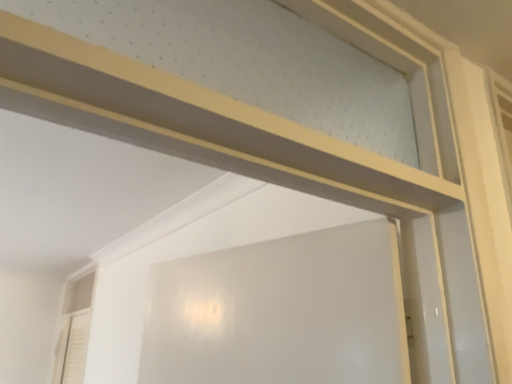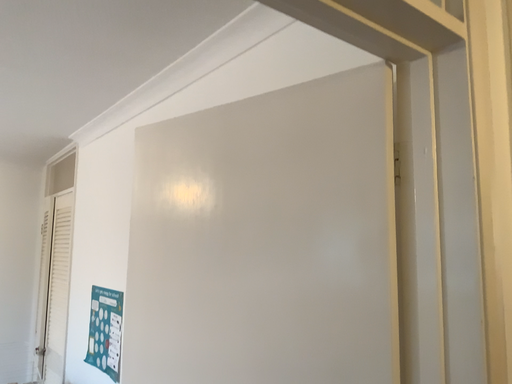
Question: How did the camera likely rotate when shooting the video?

Choices:
 (A) rotated upward
 (B) rotated downward

Answer: (B)